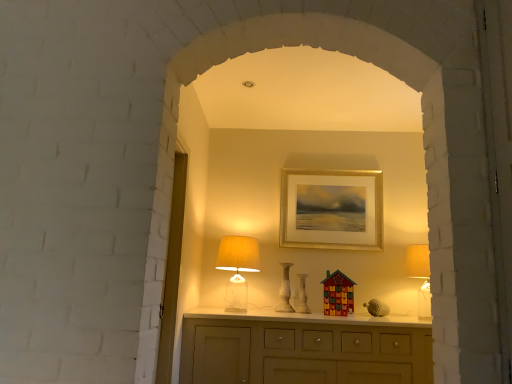
At what (x,y) coordinates should I click in order to perform the action: click on empty space that is ontop of gold/glossy picture frame at upper center (from a real-world perspective). Please return your answer as a coordinate pair (x, y). Image resolution: width=512 pixels, height=384 pixels. Looking at the image, I should click on (324, 172).